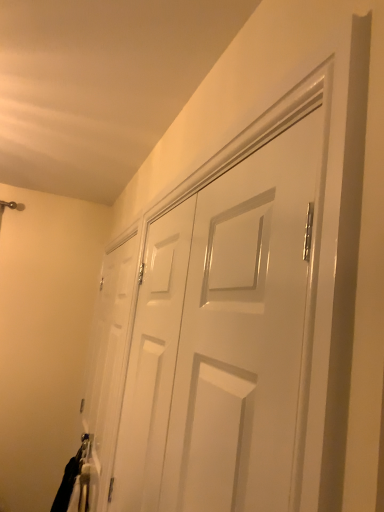
Question: Is black fabric laundry at lower left to the right of white glossy door at center, arranged as the first door when viewed from the back, from the viewer's perspective?

Choices:
 (A) yes
 (B) no

Answer: (B)

Question: Would you say black fabric laundry at lower left is a long distance from white glossy door at center, arranged as the first door when viewed from the back?

Choices:
 (A) no
 (B) yes

Answer: (A)

Question: Is black fabric laundry at lower left at the left side of white glossy door at center, arranged as the first door when viewed from the back?

Choices:
 (A) no
 (B) yes

Answer: (B)

Question: Does black fabric laundry at lower left turn towards white glossy door at center, which is the 2th door from front to back?

Choices:
 (A) yes
 (B) no

Answer: (B)

Question: From a real-world perspective, is black fabric laundry at lower left beneath white glossy door at center, arranged as the first door when viewed from the back?

Choices:
 (A) no
 (B) yes

Answer: (B)

Question: Is white glossy door at center, acting as the second door starting from the left, in front of or behind black fabric laundry at lower left in the image?

Choices:
 (A) behind
 (B) front

Answer: (B)

Question: Considering the positions of white glossy door at center, the first door in the right-to-left sequence, and black fabric laundry at lower left in the image, is white glossy door at center, the first door in the right-to-left sequence, taller or shorter than black fabric laundry at lower left?

Choices:
 (A) short
 (B) tall

Answer: (B)

Question: Would you say white glossy door at center, the 2th door in the back-to-front sequence, is inside or outside black fabric laundry at lower left?

Choices:
 (A) inside
 (B) outside

Answer: (B)

Question: In terms of width, does white glossy door at center, the 2th door in the back-to-front sequence, look wider or thinner when compared to black fabric laundry at lower left?

Choices:
 (A) wide
 (B) thin

Answer: (B)

Question: From the image's perspective, is white glossy door at center, arranged as the first door when viewed from the back, positioned above or below white glossy door at center, the 2th door in the back-to-front sequence?

Choices:
 (A) above
 (B) below

Answer: (B)

Question: From a real-world perspective, is white glossy door at center, the 2th door viewed from the right, positioned above or below white glossy door at center, which is the first door in front-to-back order?

Choices:
 (A) above
 (B) below

Answer: (B)

Question: In terms of size, does white glossy door at center, which is counted as the first door, starting from the left, appear bigger or smaller than white glossy door at center, which is the first door in front-to-back order?

Choices:
 (A) big
 (B) small

Answer: (A)

Question: In terms of width, does white glossy door at center, arranged as the first door when viewed from the back, look wider or thinner when compared to white glossy door at center, acting as the second door starting from the left?

Choices:
 (A) thin
 (B) wide

Answer: (A)

Question: Considering the positions of black fabric laundry at lower left and white glossy door at center, which is counted as the first door, starting from the left, in the image, is black fabric laundry at lower left wider or thinner than white glossy door at center, which is counted as the first door, starting from the left,?

Choices:
 (A) thin
 (B) wide

Answer: (B)

Question: Is black fabric laundry at lower left inside or outside of white glossy door at center, arranged as the first door when viewed from the back?

Choices:
 (A) inside
 (B) outside

Answer: (B)